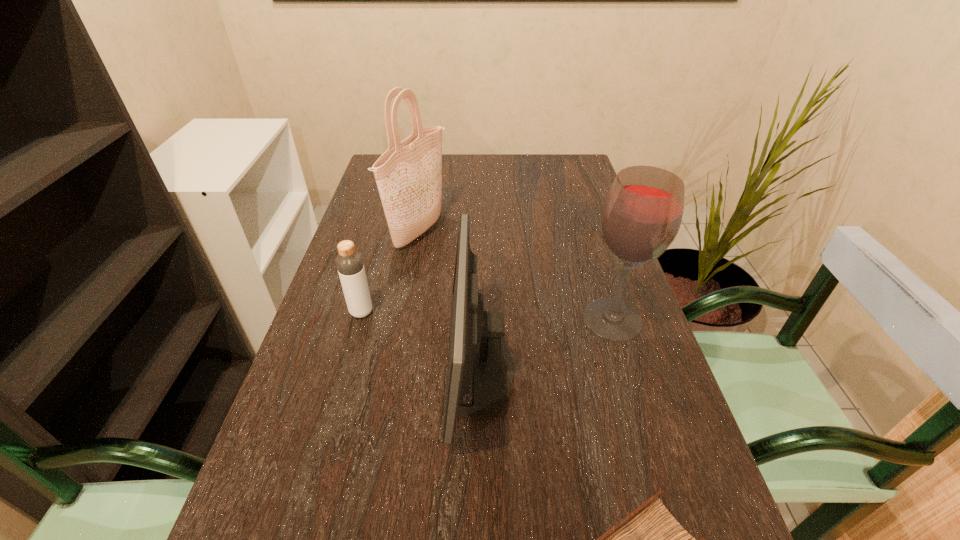
The image size is (960, 540). I want to click on object identified as the third closest to the computer monitor, so click(409, 174).

Identify the location of object that stands as the fourth closest to the computer monitor. Image resolution: width=960 pixels, height=540 pixels. (349, 262).

Where is `vacant area in the image that satisfies the following two spatial constraints: 1. on the front side of the alcohol; 2. on the left side of the shopping bag`? Image resolution: width=960 pixels, height=540 pixels. vacant area in the image that satisfies the following two spatial constraints: 1. on the front side of the alcohol; 2. on the left side of the shopping bag is located at coordinates (403, 319).